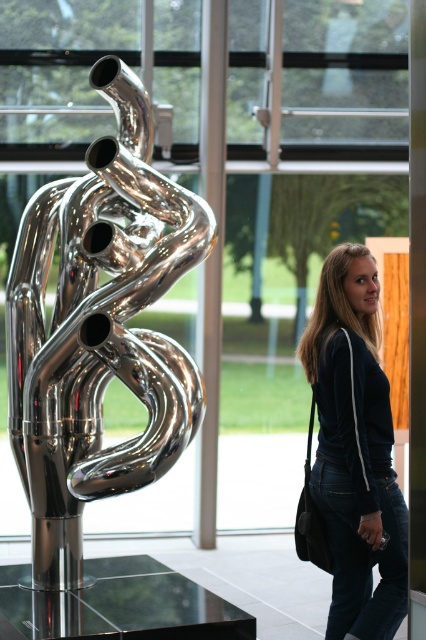
Does polished metallic sculpture at left appear over dark blue denim jeans at lower right?

Indeed, polished metallic sculpture at left is positioned over dark blue denim jeans at lower right.

The width and height of the screenshot is (426, 640). What do you see at coordinates (98, 330) in the screenshot?
I see `polished metallic sculpture at left` at bounding box center [98, 330].

Describe the element at coordinates (98, 330) in the screenshot. I see `polished metallic sculpture at left` at that location.

The width and height of the screenshot is (426, 640). I want to click on polished metallic sculpture at left, so click(x=98, y=330).